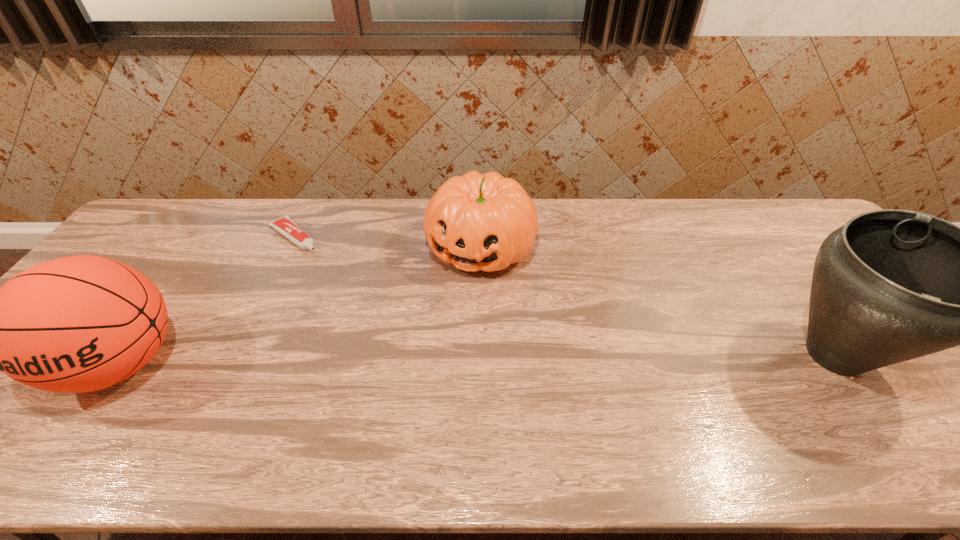
Where is `the leftmost object`? the leftmost object is located at coordinates (76, 324).

What are the coordinates of `the rightmost object` in the screenshot? It's located at (891, 285).

The width and height of the screenshot is (960, 540). I want to click on the third tallest object, so click(486, 222).

Where is `pumpkin`? The image size is (960, 540). pumpkin is located at coordinates (486, 222).

I want to click on toothpaste, so click(287, 227).

Image resolution: width=960 pixels, height=540 pixels. I want to click on the third object from right to left, so click(287, 227).

The height and width of the screenshot is (540, 960). Find the location of `free space located 0.300m on the left of the rightmost object`. free space located 0.300m on the left of the rightmost object is located at coordinates (650, 355).

Image resolution: width=960 pixels, height=540 pixels. What are the coordinates of `vacant region located 0.370m on the carved face of the third tallest object` in the screenshot? It's located at (405, 390).

At what (x,y) coordinates should I click in order to perform the action: click on vacant space located 0.210m on the carved face of the third tallest object. Please return your answer as a coordinate pair (x, y). Looking at the image, I should click on (433, 338).

At what (x,y) coordinates should I click in order to perform the action: click on vacant space located 0.390m on the carved face of the third tallest object. Please return your answer as a coordinate pair (x, y). Looking at the image, I should click on (401, 397).